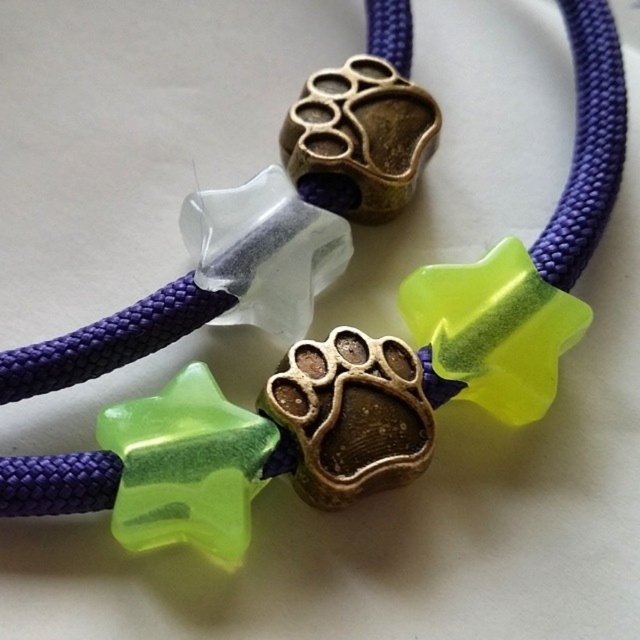
Between bronze textured paw print at center and antique brass paw print at center, which one appears on the right side from the viewer's perspective?

Positioned to the right is antique brass paw print at center.

Between point (376, 371) and point (356, 90), which one is positioned in front?

Point (376, 371)

Describe the element at coordinates (349, 416) in the screenshot. The width and height of the screenshot is (640, 640). I see `bronze textured paw print at center` at that location.

I want to click on bronze textured paw print at center, so click(x=349, y=416).